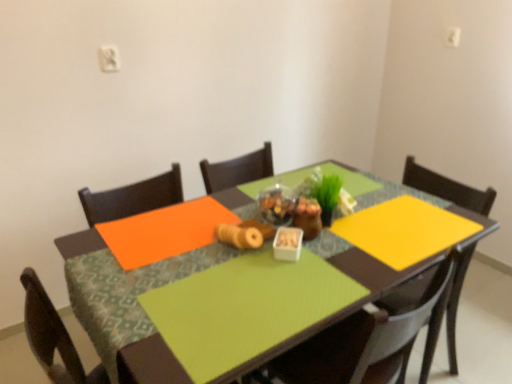
Question: Considering their positions, is matte brown chair at center located in front of or behind green fabric table at center?

Choices:
 (A) behind
 (B) front

Answer: (A)

Question: From the image's perspective, is matte brown chair at center located above or below green fabric table at center?

Choices:
 (A) below
 (B) above

Answer: (A)

Question: Considering the real-world distances, which object is farthest from the green fabric table at center?

Choices:
 (A) white matte container at center
 (B) matte brown chair at center
 (C) green matte plant at center

Answer: (C)

Question: Which object is positioned closest to the matte brown chair at center?

Choices:
 (A) white matte container at center
 (B) green matte plant at center
 (C) green fabric table at center

Answer: (C)